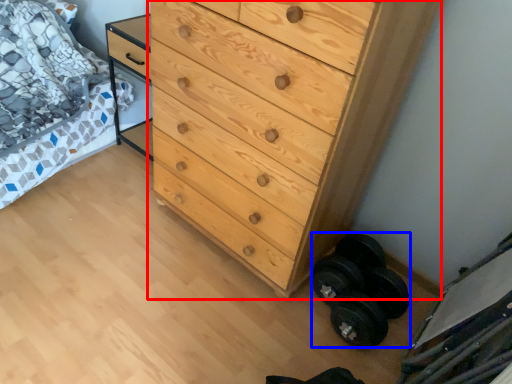
Question: Which object is closer to the camera taking this photo, chest of drawers (highlighted by a red box) or dumbbell (highlighted by a blue box)?

Choices:
 (A) chest of drawers
 (B) dumbbell

Answer: (A)